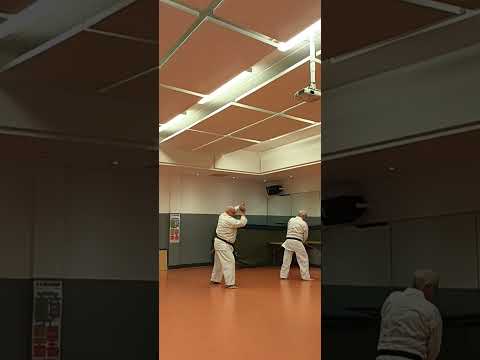
Where is `wall`? The image size is (480, 360). wall is located at coordinates (241, 199).